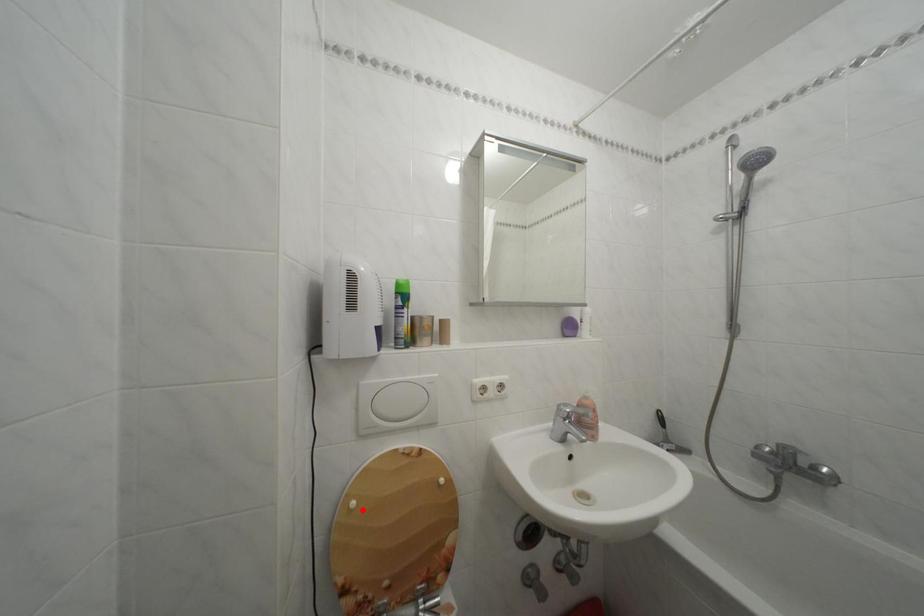
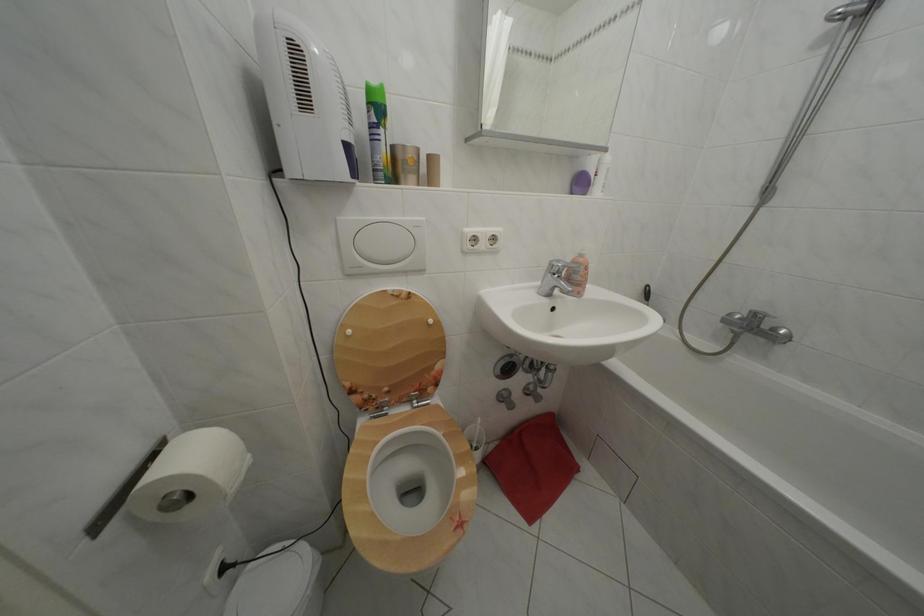
Locate, in the second image, the point that corresponds to the highlighted location in the first image.

(358, 338)